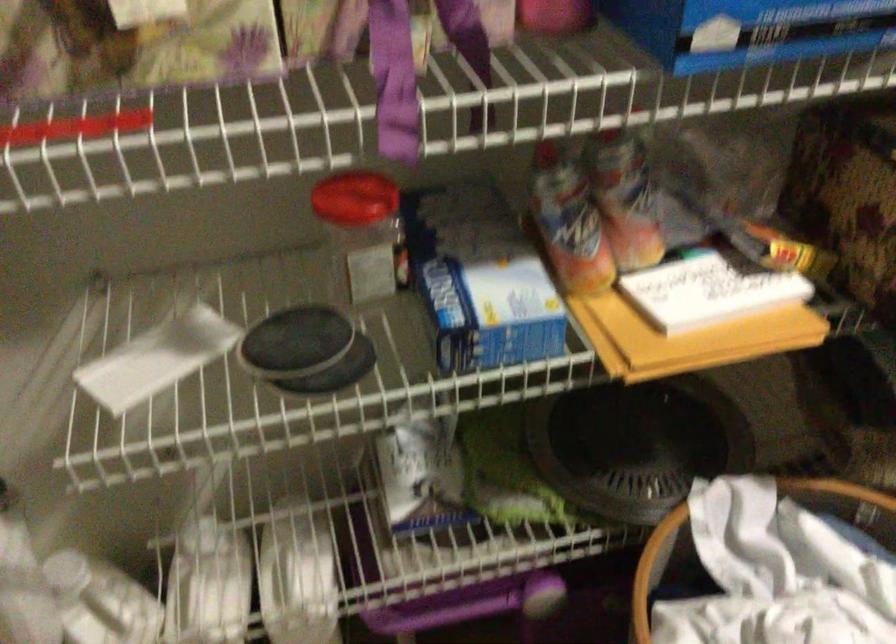
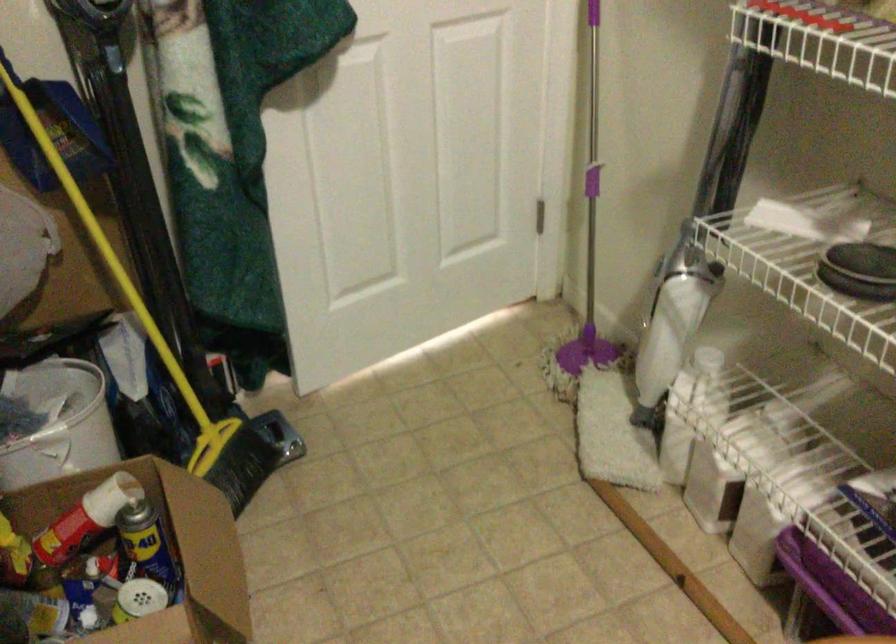
First-person continuous shooting, in which direction is the camera rotating?

The camera's rotation is toward left-down.